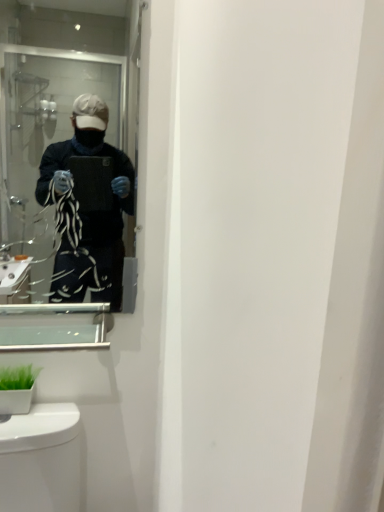
Question: Looking at the image, does green matte plant at lower left seem bigger or smaller compared to clear glass medicine cabinet at lower left?

Choices:
 (A) small
 (B) big

Answer: (B)

Question: From their relative heights in the image, would you say green matte plant at lower left is taller or shorter than clear glass medicine cabinet at lower left?

Choices:
 (A) short
 (B) tall

Answer: (B)

Question: Estimate the real-world distances between objects in this image. Which object is closer to the clear glass medicine cabinet at lower left?

Choices:
 (A) green matte plant at lower left
 (B) clear glass mirror at upper left

Answer: (A)

Question: Estimate the real-world distances between objects in this image. Which object is closer to the clear glass mirror at upper left?

Choices:
 (A) green matte plant at lower left
 (B) clear glass medicine cabinet at lower left

Answer: (B)